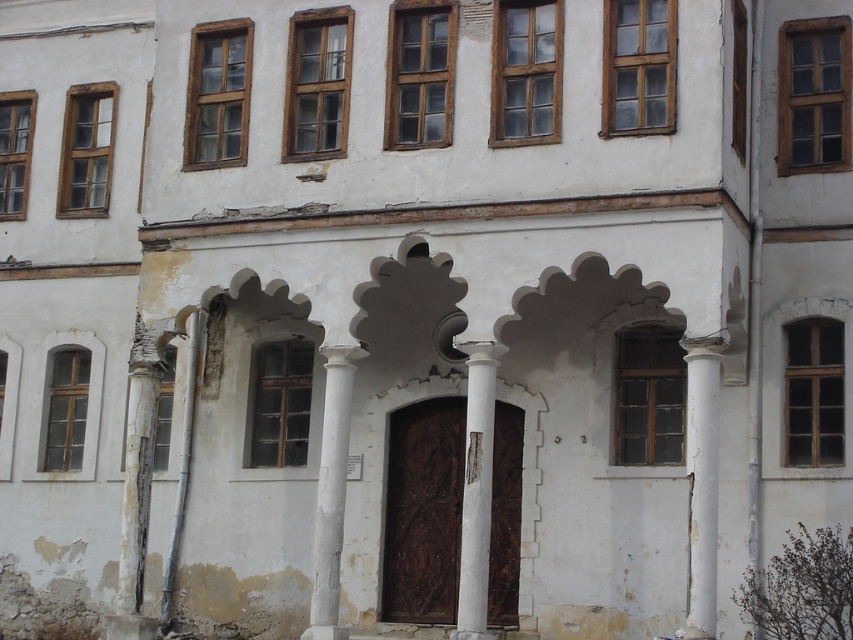
You are an architect inspecting the building facade. You notice the white stone column at center and the white concrete pillar at left. Which one has a larger size according to the description?

The white stone column at center is bigger than the white concrete pillar at left, so the white stone column at center has a larger size.

You are standing in front of the old building and notice a point marked at coordinates [331,492]. Which architectural feature does this point most likely indicate?

The point at coordinates [331,492] corresponds to the white stone column at center.